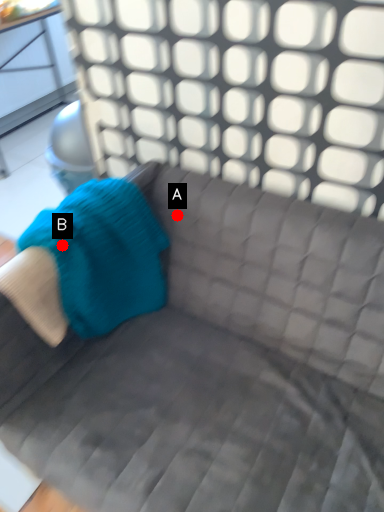
Question: Two points are circled on the image, labeled by A and B beside each circle. Which point is closer to the camera?

Choices:
 (A) A is closer
 (B) B is closer

Answer: (B)